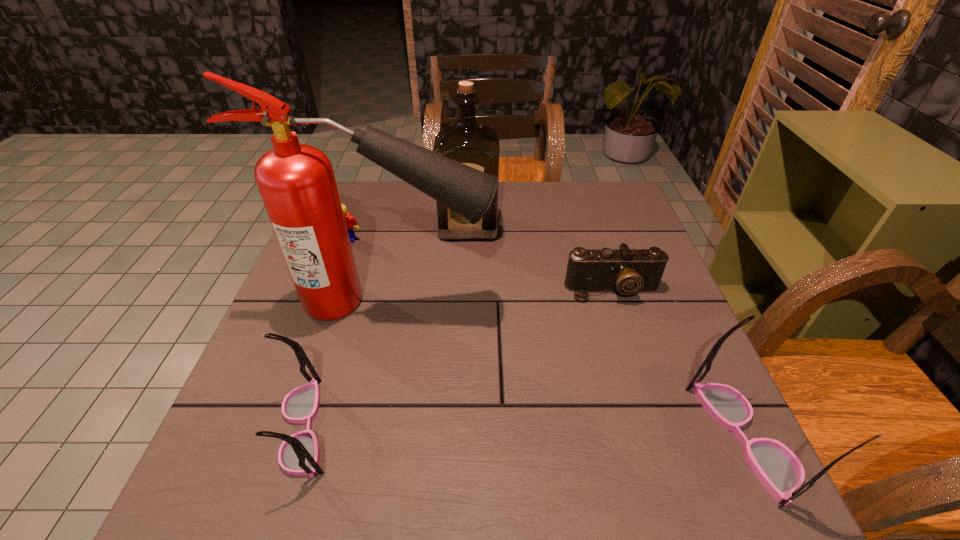
Where is `empty space that is in between the liquor and the shorter spectacles`? empty space that is in between the liquor and the shorter spectacles is located at coordinates (387, 327).

You are a GUI agent. You are given a task and a screenshot of the screen. Output one action in this format:
    pyautogui.click(x=<x>, y=<y>)
    Task: Click on the empty location between the Lego and the liquor
    Image resolution: width=960 pixels, height=540 pixels.
    Given the screenshot: What is the action you would take?
    pyautogui.click(x=408, y=234)

Find the location of a particular element. The height and width of the screenshot is (540, 960). free space between the third tallest object and the camera is located at coordinates (679, 364).

Find the location of a particular element. The height and width of the screenshot is (540, 960). free point between the camera and the fifth shortest object is located at coordinates (540, 259).

Identify the location of free space between the Lego and the taller spectacles. coord(546,339).

You are a GUI agent. You are given a task and a screenshot of the screen. Output one action in this format:
    pyautogui.click(x=<x>, y=<y>)
    Task: Click on the free spot between the shorter spectacles and the Lego
    
    Given the screenshot: What is the action you would take?
    pyautogui.click(x=326, y=334)

Locate an element on the screen. The width and height of the screenshot is (960, 540). vacant space that's between the Lego and the fire extinguisher is located at coordinates (369, 271).

Image resolution: width=960 pixels, height=540 pixels. What are the coordinates of `free space between the Lego and the shorter spectacles` in the screenshot? It's located at (326, 334).

Find the location of a particular element. object that stands as the fourth closest to the shorter spectacles is located at coordinates (625, 270).

Locate an element on the screen. object that can be found as the third closest to the camera is located at coordinates (779, 470).